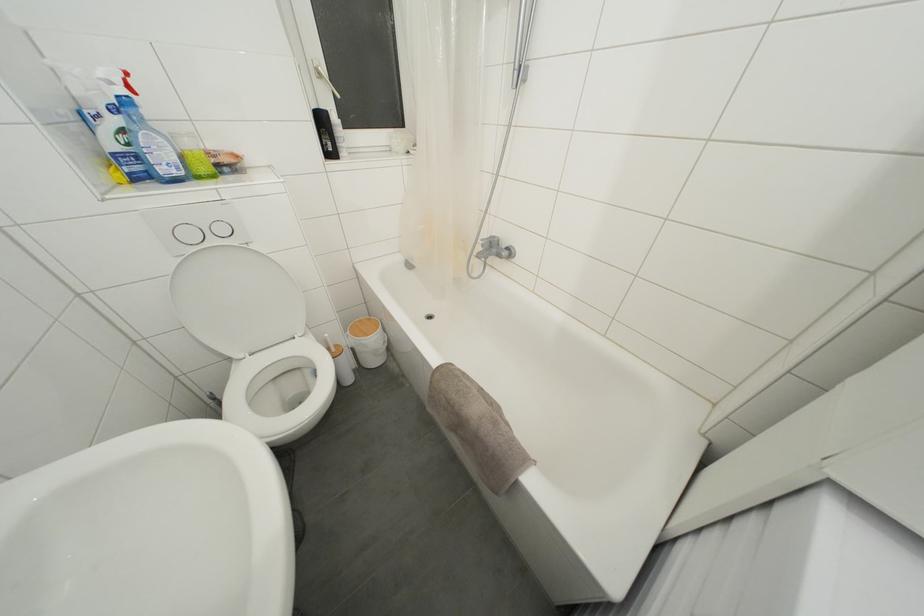
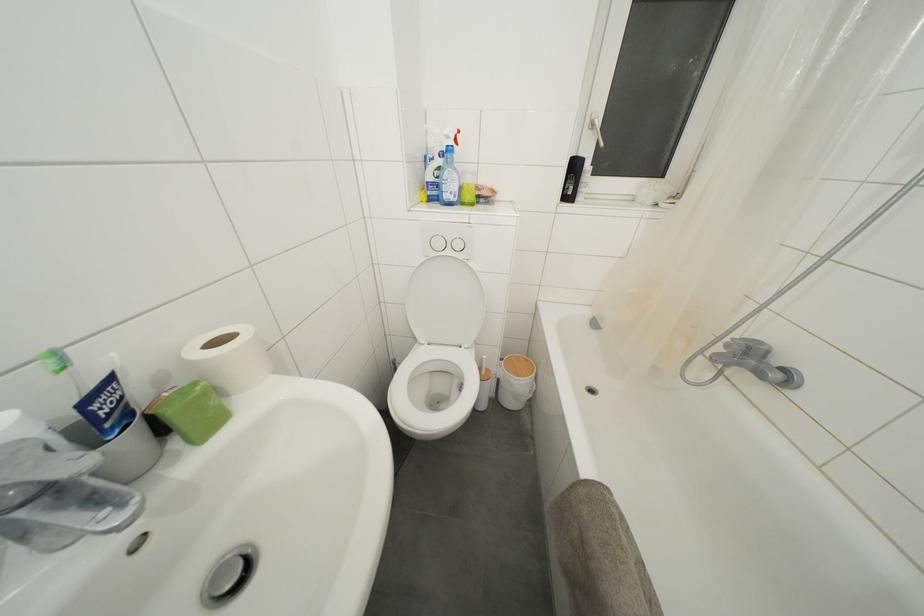
Where in the second image is the point corresponding to point (323, 79) from the first image?

(597, 131)